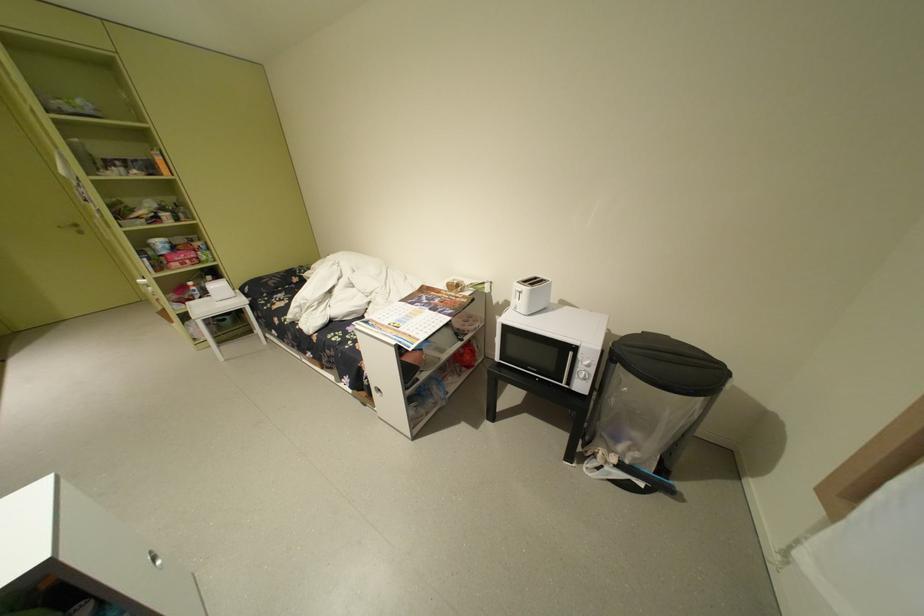
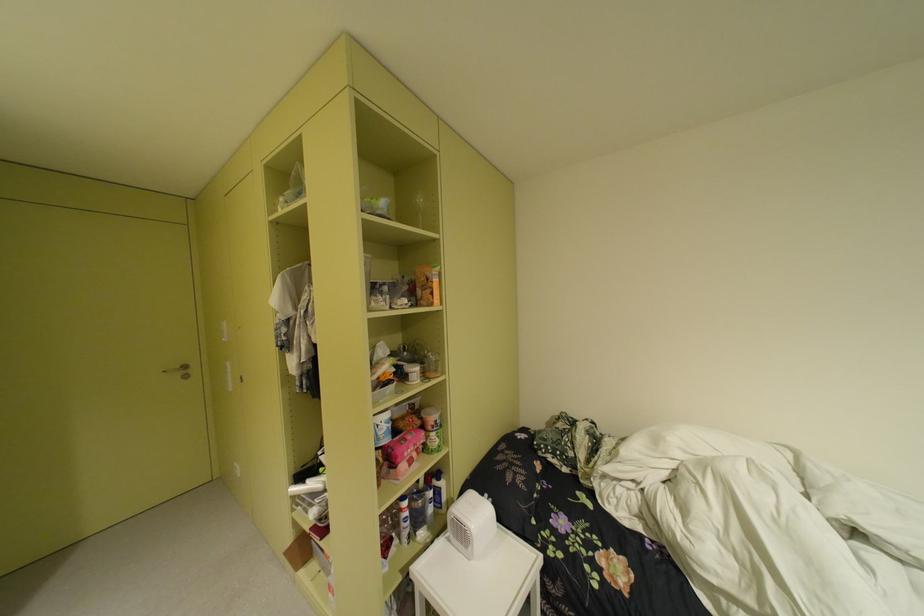
In the second image, find the point that corresponds to point 70,228 in the first image.

(175, 371)